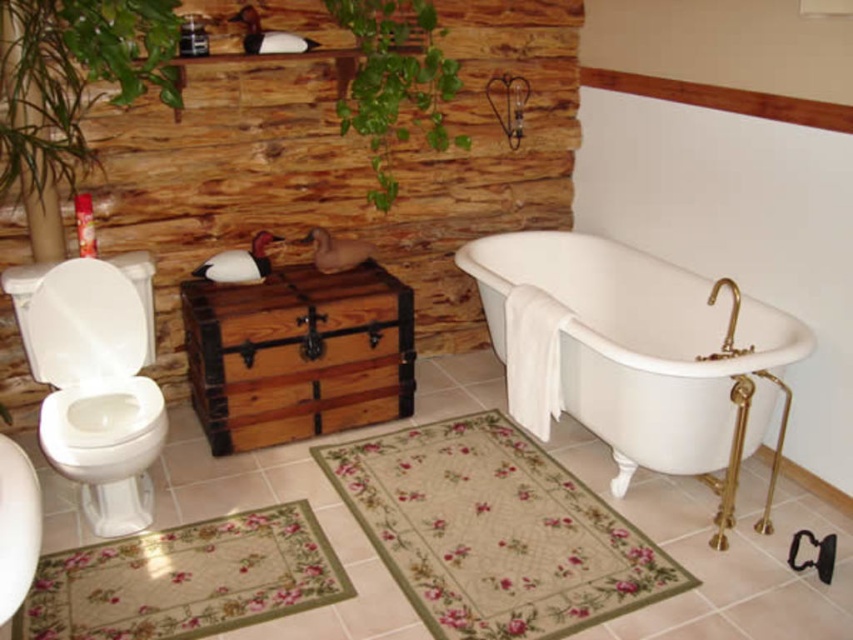
You are a bathroom designer planning to place a new decorative item between the white porcelain bathtub at center and the green leafy plant at upper center. Based on their positions, which object should the decorative item be closer to?

The white porcelain bathtub at center is positioned on the right side of the green leafy plant at upper center, so the decorative item should be placed closer to the green leafy plant at upper center to maintain balance between them.

You are a guest in this bathroom and want to find the toilet quickly. Which object is positioned lower in the bathroom, the white glossy toilet bowl at left or the green leafy plant at upper center?

The white glossy toilet bowl at left is located below the green leafy plant at upper center, so the toilet bowl is lower.

You are standing in the bathroom and need to locate the white glossy toilet bowl at left. According to the coordinates provided, where would you find it?

The white glossy toilet bowl at left is located at point (94,381).